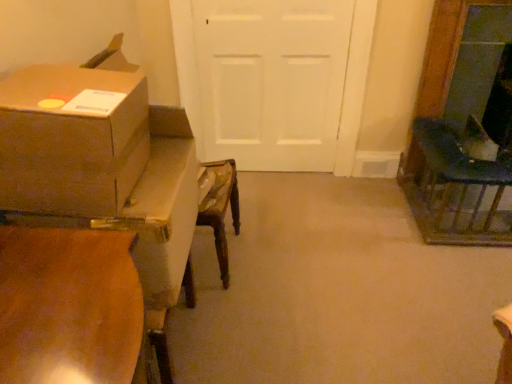
Question: Considering the relative sizes of dark green fabric chair at right and brown cardboard box at left in the image provided, is dark green fabric chair at right smaller than brown cardboard box at left?

Choices:
 (A) no
 (B) yes

Answer: (A)

Question: Is dark green fabric chair at right shorter than brown cardboard box at left?

Choices:
 (A) yes
 (B) no

Answer: (B)

Question: Is dark green fabric chair at right taller than brown cardboard box at left?

Choices:
 (A) no
 (B) yes

Answer: (B)

Question: Is the depth of dark green fabric chair at right greater than that of brown cardboard box at left?

Choices:
 (A) yes
 (B) no

Answer: (A)

Question: Is dark green fabric chair at right facing towards brown cardboard box at left?

Choices:
 (A) no
 (B) yes

Answer: (A)

Question: From the image's perspective, would you say dark green fabric chair at right is shown under brown cardboard box at left?

Choices:
 (A) no
 (B) yes

Answer: (B)

Question: Is white matte door at center taller than dark green fabric chair at right?

Choices:
 (A) no
 (B) yes

Answer: (B)

Question: Is the depth of white matte door at center less than that of dark green fabric chair at right?

Choices:
 (A) yes
 (B) no

Answer: (B)

Question: Does white matte door at center have a larger size compared to dark green fabric chair at right?

Choices:
 (A) yes
 (B) no

Answer: (B)

Question: From the image's perspective, does white matte door at center appear lower than dark green fabric chair at right?

Choices:
 (A) no
 (B) yes

Answer: (A)

Question: Is white matte door at center positioned with its back to dark green fabric chair at right?

Choices:
 (A) no
 (B) yes

Answer: (A)

Question: Is white matte door at center completely or partially outside of dark green fabric chair at right?

Choices:
 (A) no
 (B) yes

Answer: (B)

Question: From the image's perspective, is wooden table at left beneath brown cardboard box at left?

Choices:
 (A) no
 (B) yes

Answer: (B)